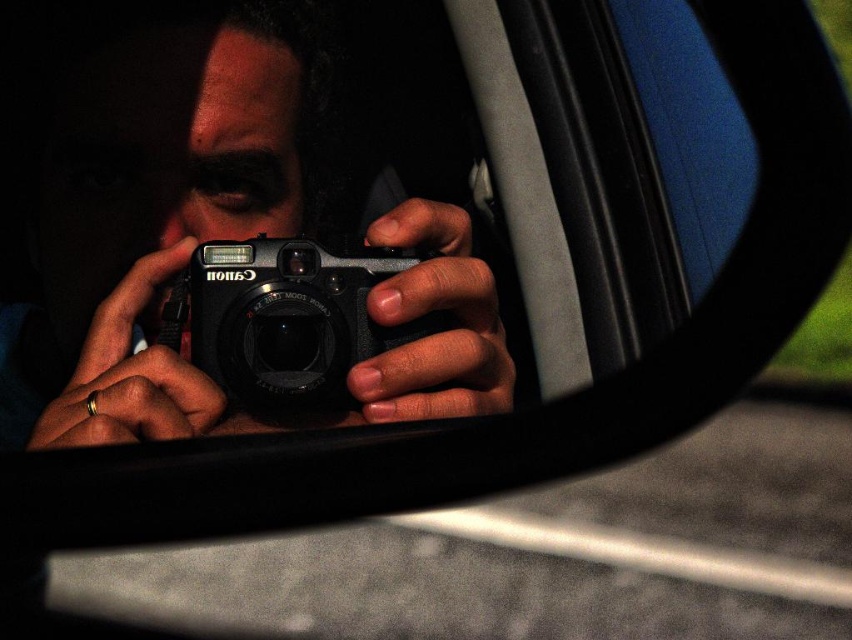
You are a photographer trying to choose between two cameras in the car. The scene shows a matte black camera at center and a black plastic camera at center. Which camera is taller?

The matte black camera at center is taller than the black plastic camera at center.

Consider the image. You are a photographer trying to choose between two cameras in the store. The matte black camera at center and the black plastic camera at center are both on display. Which one has a greater width?

The matte black camera at center has a greater width than the black plastic camera at center according to the description.

You are a photographer adjusting your camera settings inside the car. You notice two points marked in the rearview mirror. The first point is at coordinate point (131, 195) and the second is at point (344, 253). Which point is closer to the camera lens?

Point (131, 195) is behind point (344, 253), so the point closer to the camera lens is point (344, 253).